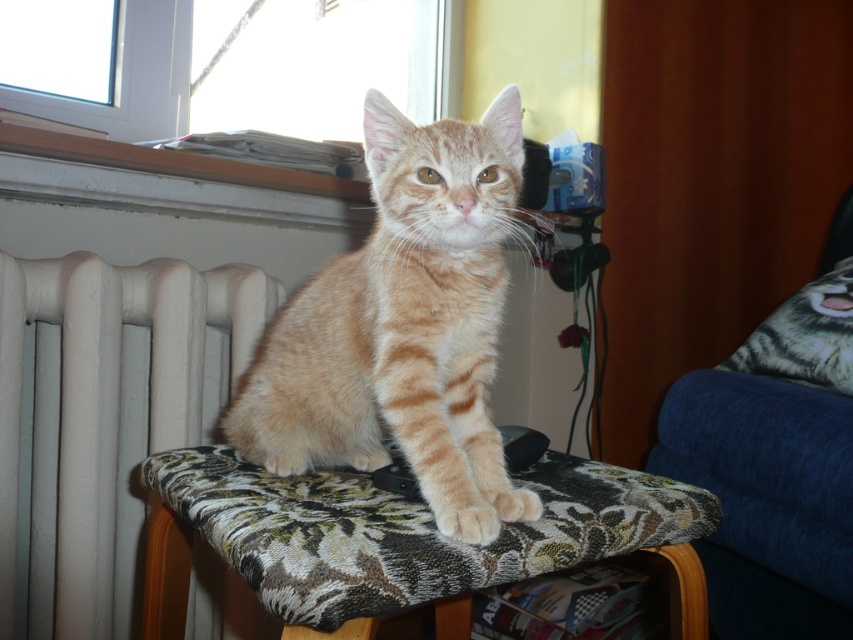
Question: Can you confirm if orange tabby cat at center is smaller than tabby fur pillow at right?

Choices:
 (A) yes
 (B) no

Answer: (B)

Question: Among these objects, which one is nearest to the camera?

Choices:
 (A) tabby fur pillow at right
 (B) orange tabby cat at center
 (C) white matte radiator at left

Answer: (B)

Question: Does orange tabby cat at center come in front of blue fabric armchair at right?

Choices:
 (A) no
 (B) yes

Answer: (B)

Question: Estimate the real-world distances between objects in this image. Which object is closer to the white painted wood at upper left?

Choices:
 (A) white matte radiator at left
 (B) tabby fur pillow at right

Answer: (A)

Question: Which of these objects is positioned farthest from the white painted wood at upper left?

Choices:
 (A) white matte radiator at left
 (B) tabby fur pillow at right
 (C) blue fabric armchair at right
 (D) orange tabby cat at center

Answer: (B)

Question: Does blue fabric armchair at right have a smaller size compared to white painted wood at upper left?

Choices:
 (A) yes
 (B) no

Answer: (B)